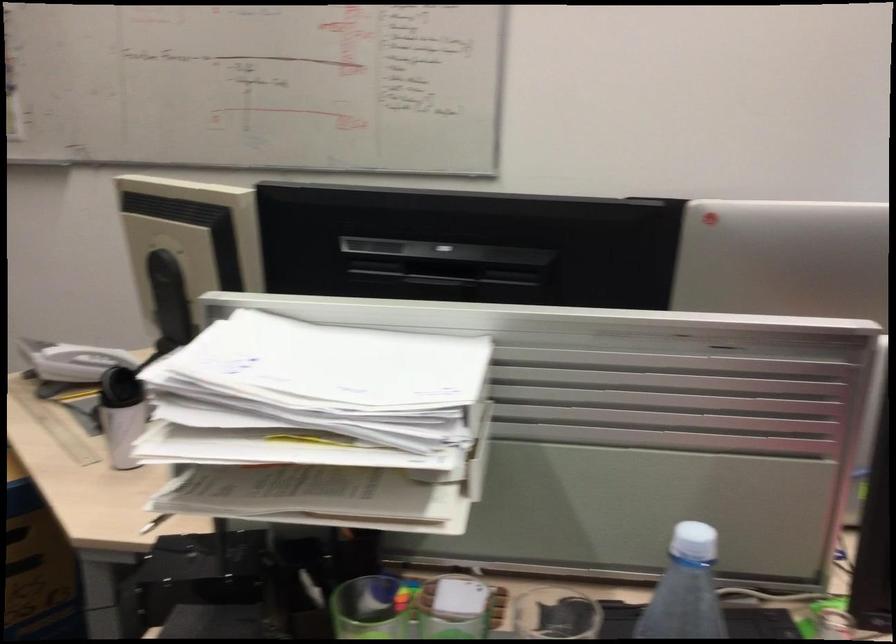
Where is `white paper tray`? white paper tray is located at coordinates (333, 365).